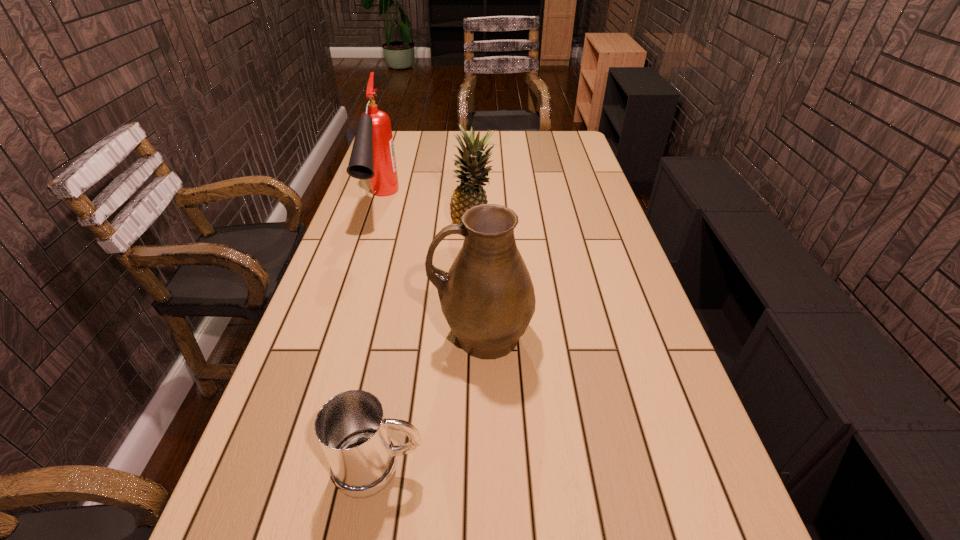
This screenshot has height=540, width=960. What are the coordinates of `empty space between the mug and the pitcher` in the screenshot? It's located at (431, 401).

Image resolution: width=960 pixels, height=540 pixels. What are the coordinates of `free area in between the pineapple and the fire extinguisher` in the screenshot? It's located at (427, 215).

This screenshot has width=960, height=540. I want to click on blank region between the mug and the second nearest object, so click(x=431, y=401).

You are a GUI agent. You are given a task and a screenshot of the screen. Output one action in this format:
    pyautogui.click(x=<x>, y=<y>)
    Task: Click on the empty location between the fire extinguisher and the pineapple
    This screenshot has width=960, height=540.
    Given the screenshot: What is the action you would take?
    pyautogui.click(x=427, y=215)

The height and width of the screenshot is (540, 960). Find the location of `blank region between the leftmost object and the mug`. blank region between the leftmost object and the mug is located at coordinates (380, 335).

Identify the location of the second closest object to the shortest object. (470, 192).

Locate an element on the screen. This screenshot has height=540, width=960. the closest object to the leftmost object is located at coordinates (470, 192).

The height and width of the screenshot is (540, 960). Identify the location of vacant space that satisfies the following two spatial constraints: 1. at the nozzle of the pineapple; 2. on the right side of the leftmost object. (372, 228).

The image size is (960, 540). What are the coordinates of `free point that satisfies the following two spatial constraints: 1. on the front side of the pineapple; 2. on the side of the shortest object with the handle` in the screenshot? It's located at (469, 467).

At what (x,y) coordinates should I click in order to perform the action: click on free space that satisfies the following two spatial constraints: 1. on the handle side of the pitcher; 2. at the nozzle of the leftmost object. Please return your answer as a coordinate pair (x, y). The image size is (960, 540). Looking at the image, I should click on (481, 204).